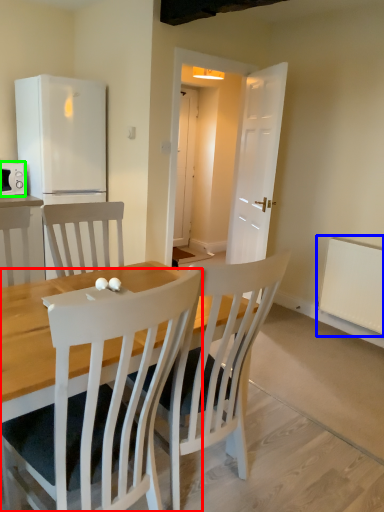
Question: Based on their relative distances, which object is nearer to chair (highlighted by a red box)? Choose from radiator (highlighted by a blue box) and microwave oven (highlighted by a green box).

Choices:
 (A) radiator
 (B) microwave oven

Answer: (A)